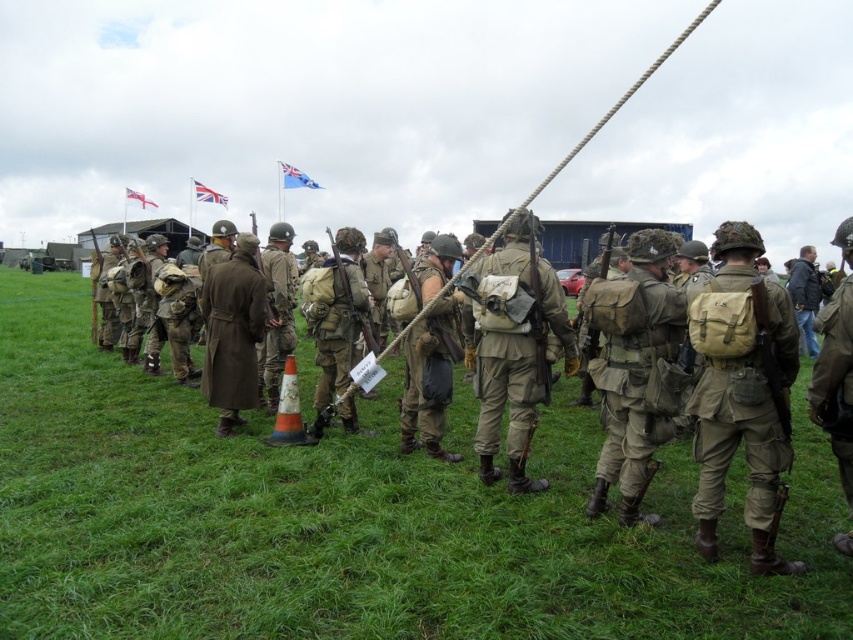
Question: Does green grassy at center lie behind matte khaki uniform at center?

Choices:
 (A) yes
 (B) no

Answer: (B)

Question: Estimate the real-world distances between objects in this image. Which object is farther from the brown wool coat at center?

Choices:
 (A) tan canvas backpack at center
 (B) white fabric flag at upper left
 (C) matte khaki uniform at center

Answer: (B)

Question: Is the position of matte khaki uniform at center more distant than that of dark blue jacket at center?

Choices:
 (A) no
 (B) yes

Answer: (B)

Question: Observing the image, what is the correct spatial positioning of brown wool coat at center in reference to white fabric flag at upper left?

Choices:
 (A) below
 (B) above

Answer: (A)

Question: Which point is closer to the camera?

Choices:
 (A) (206, 186)
 (B) (752, 276)

Answer: (B)

Question: Estimate the real-world distances between objects in this image. Which object is farther from the brown wool coat at center?

Choices:
 (A) matte khaki uniform at center
 (B) blue fabric flag at upper center
 (C) tan canvas backpack at center-right
 (D) white fabric flag at upper left

Answer: (D)